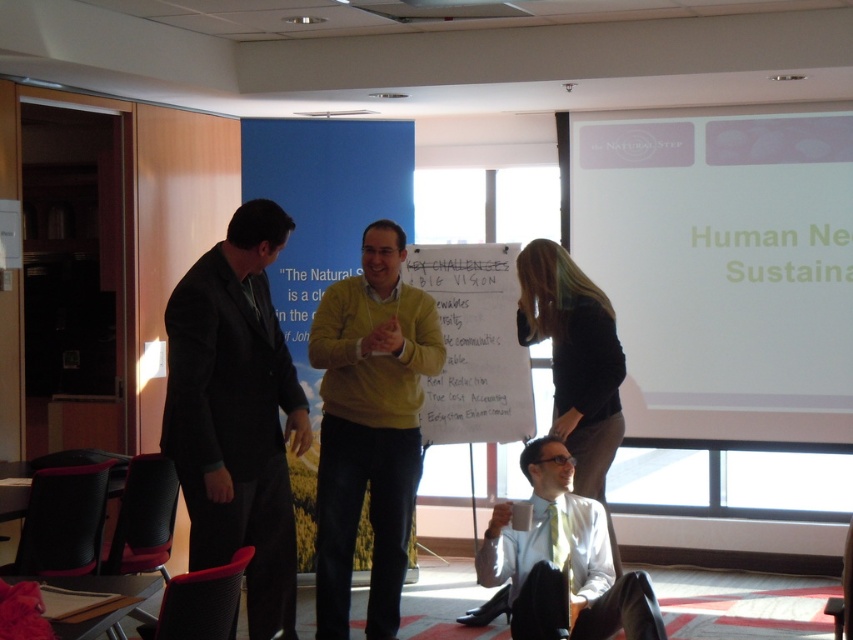
Can you confirm if white matte projection screen at upper right is smaller than matte yellow sweater at center?

No, white matte projection screen at upper right is not smaller than matte yellow sweater at center.

Does white matte projection screen at upper right appear under matte yellow sweater at center?

No.

Locate an element on the screen. This screenshot has width=853, height=640. white matte projection screen at upper right is located at coordinates (723, 264).

Which is more to the right, white glossy mug at lower center or light brown leather jacket at lower center?

light brown leather jacket at lower center is more to the right.

Is white glossy mug at lower center above light brown leather jacket at lower center?

No.

Between point (538, 497) and point (521, 333), which one is positioned in front?

Positioned in front is point (538, 497).

I want to click on white glossy mug at lower center, so click(561, 561).

Is the position of black suit at left less distant than that of light brown leather jacket at lower center?

That is True.

Where is `black suit at left`? Image resolution: width=853 pixels, height=640 pixels. black suit at left is located at coordinates (236, 413).